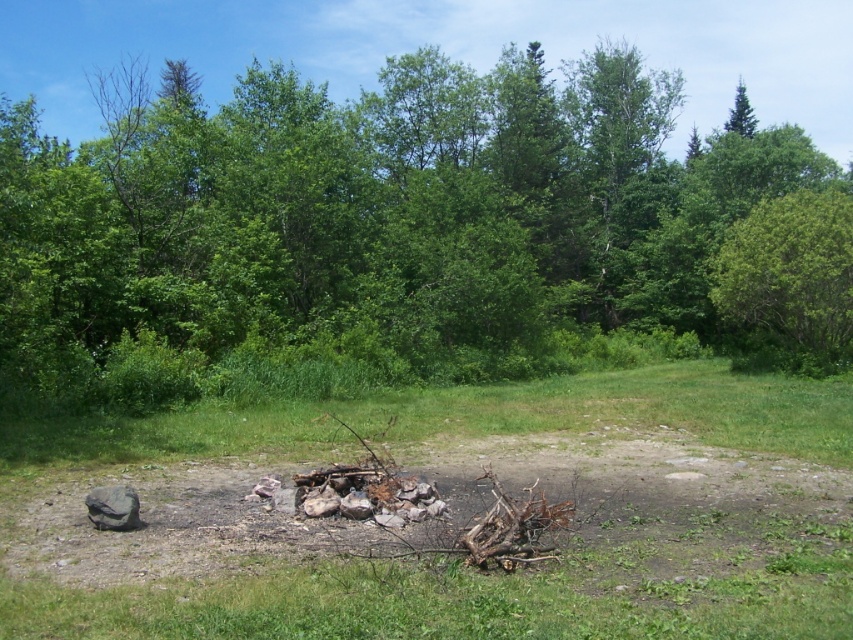
Question: Is green leafy tree at center below green leafy tree at upper right?

Choices:
 (A) no
 (B) yes

Answer: (A)

Question: Which of the following is the farthest from the observer?

Choices:
 (A) (828, 268)
 (B) (135, 156)

Answer: (B)

Question: Considering the relative positions of green leafy tree at center and green leafy tree at upper right in the image provided, where is green leafy tree at center located with respect to green leafy tree at upper right?

Choices:
 (A) right
 (B) left

Answer: (B)

Question: Observing the image, what is the correct spatial positioning of green leafy tree at center in reference to green leafy tree at upper right?

Choices:
 (A) above
 (B) below

Answer: (A)